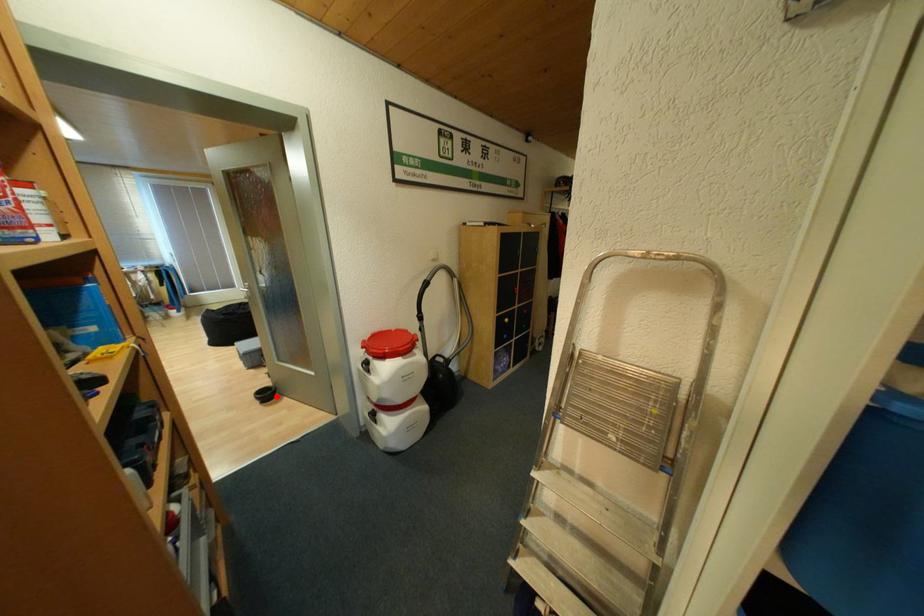
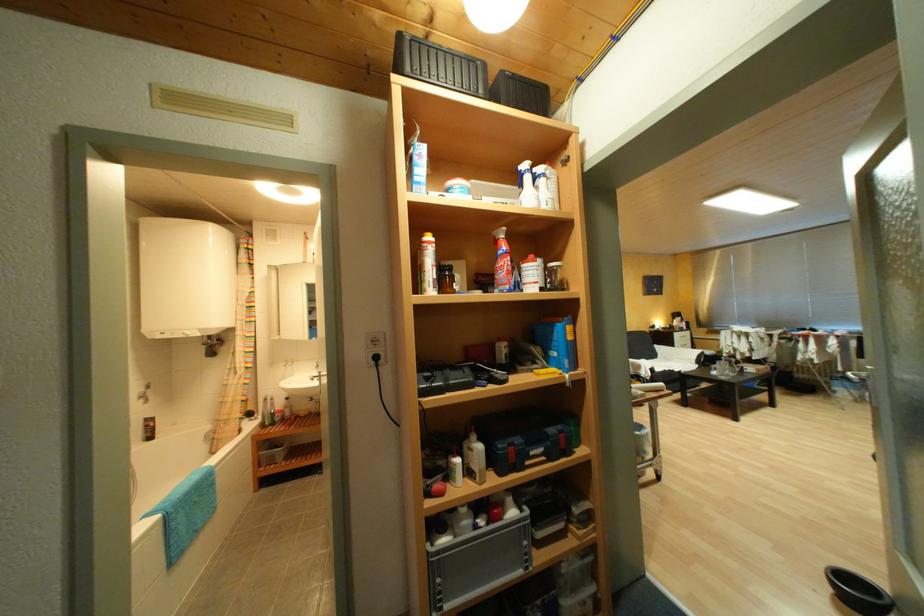
Question: I am providing you with two images of the same scene from different viewpoints. A red point is shown in image1. For the corresponding object point in image2, is it positioned nearer or farther from the camera?

Choices:
 (A) Nearer
 (B) Farther

Answer: (B)